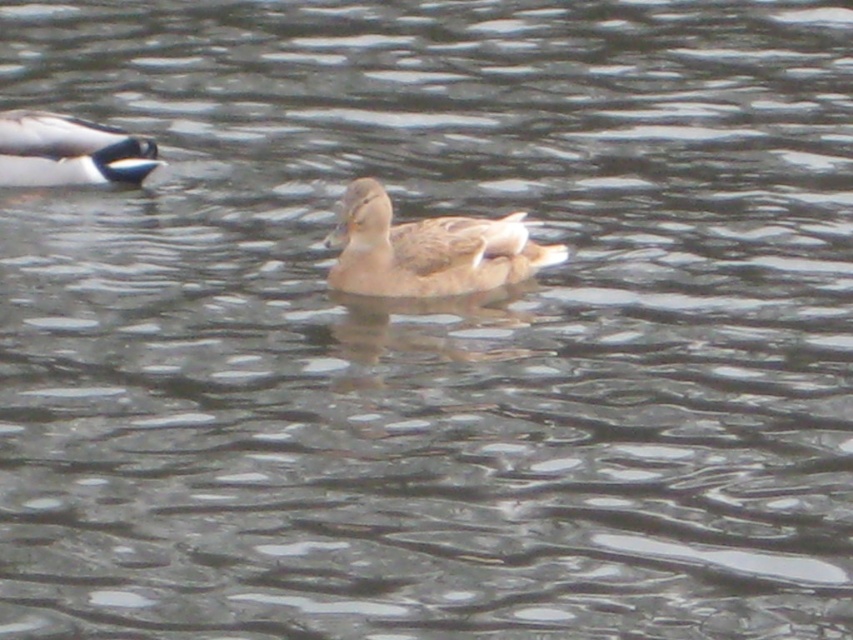
You are a photographer trying to capture both the brown matte duck at center and the white glossy duck at upper left in a single shot. Which duck will appear larger in your photo?

The brown matte duck at center will appear larger in the photo because it is closer to the camera than the white glossy duck at upper left.

Consider the image. You are standing at the edge of the water and see the brown matte duck at center. If you want to throw a pebble to hit the duck, where should you aim? Please provide coordinates in the format of point format like point (427, 250).

The brown matte duck at center is represented by point (427, 250), so you should aim at point (427, 250).

You are a photographer trying to capture the brown matte duck at center in the image. What are the exact coordinates where you should focus your camera to ensure the duck is centered in your shot?

The exact coordinates to focus the camera on the brown matte duck at center are at point (427,250).